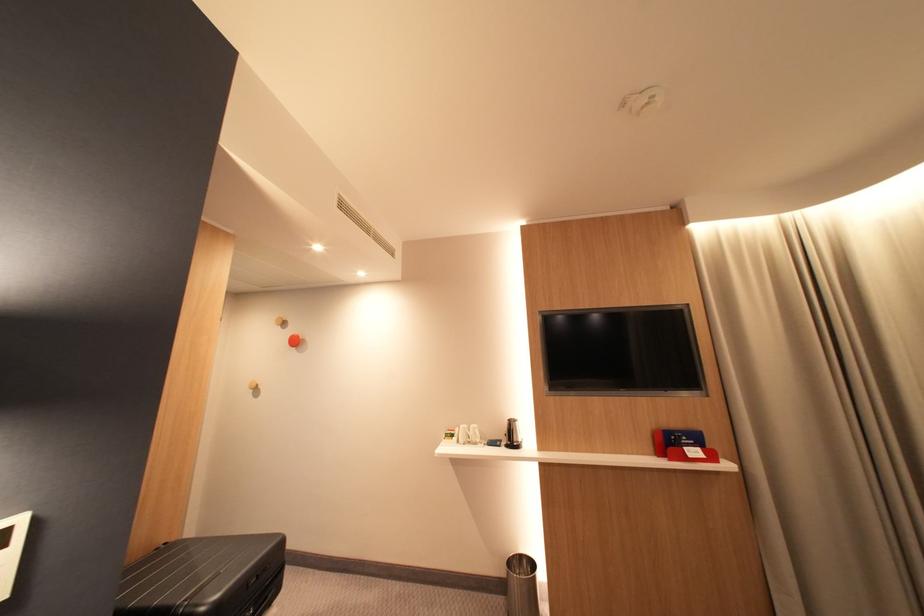
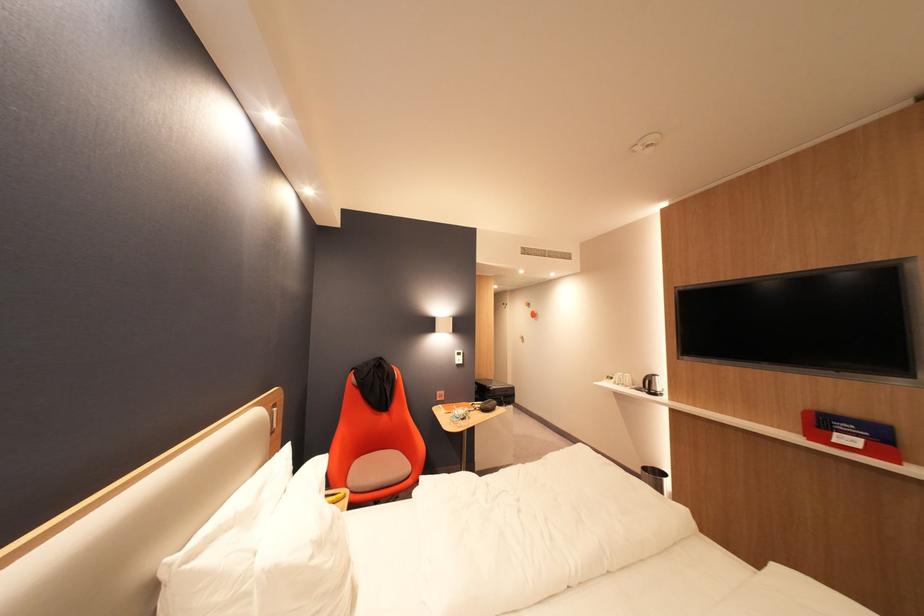
Locate, in the second image, the point that corresponds to (x=696, y=450) in the first image.

(846, 435)